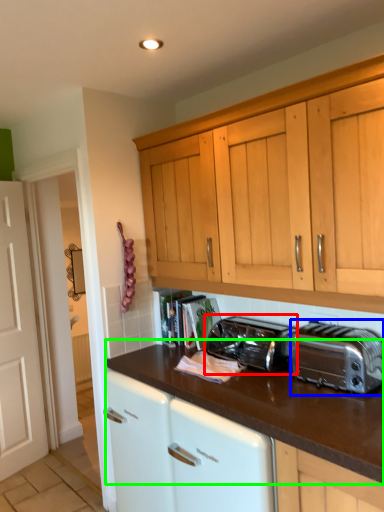
Question: Which object is the farthest from toaster (highlighted by a red box)? Choose among these: toaster (highlighted by a blue box) or countertop (highlighted by a green box).

Choices:
 (A) toaster
 (B) countertop

Answer: (A)